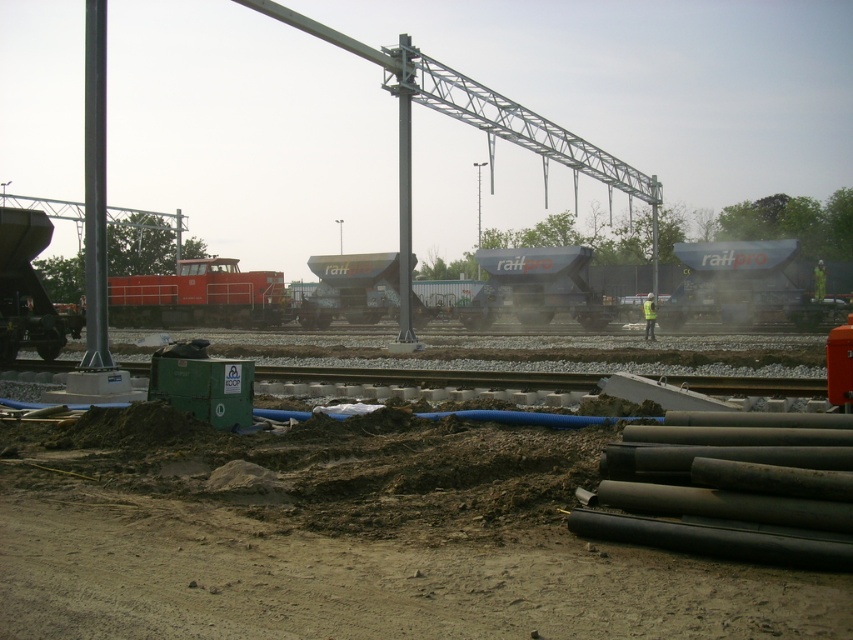
You are a construction worker needing to install a new sensor that requires a pole of at least 3 meters in height. Given the smooth metallic pole at left and the metallic gray pole at center, which pole should you choose?

The metallic gray pole at center is taller than the smooth metallic pole at left, so you should choose the metallic gray pole at center for installing the sensor as it meets the height requirement.

You are a construction worker standing at the point marked by the coordinates point (x=349, y=538). What is the nearest object to you in the image?

The nearest object to you at point (x=349, y=538) is the brown soil at lower left, as the coordinates mark its location.